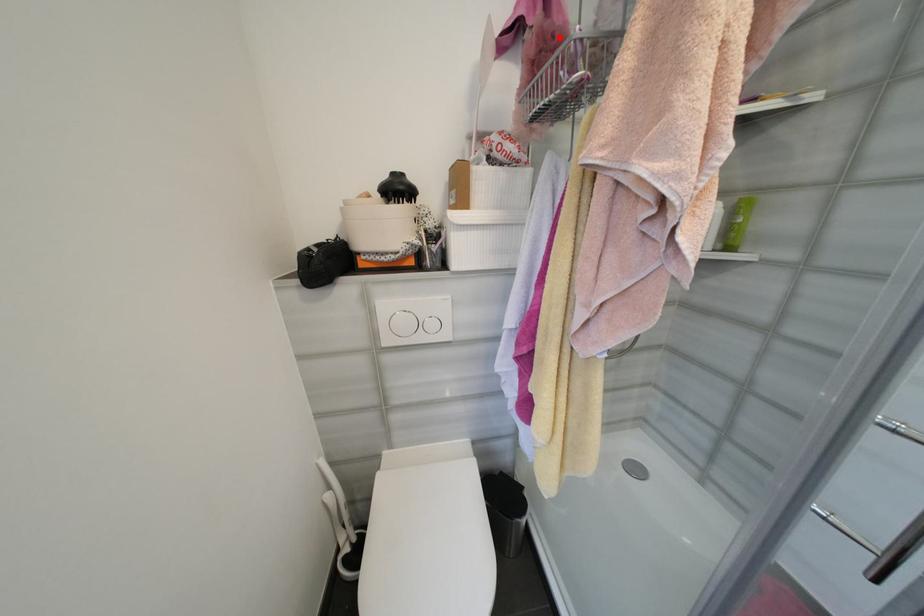
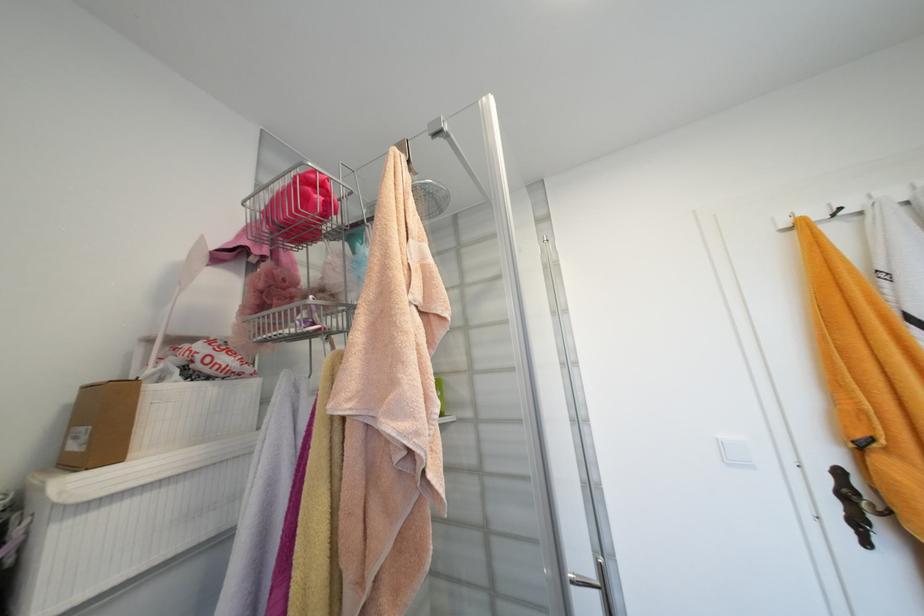
The point at the highlighted location is marked in the first image. Where is the corresponding point in the second image?

(289, 282)